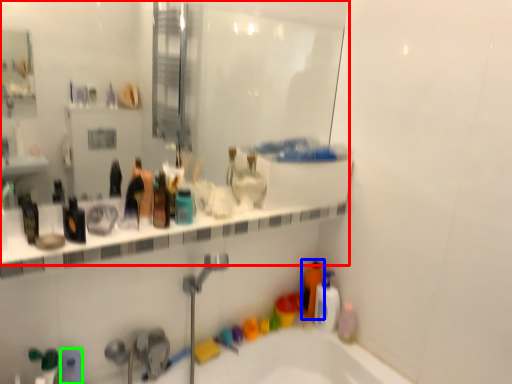
Question: Based on their relative distances, which object is farther from mirror (highlighted by a red box)? Choose from cleaning product (highlighted by a blue box) and toiletry (highlighted by a green box).

Choices:
 (A) cleaning product
 (B) toiletry

Answer: (B)